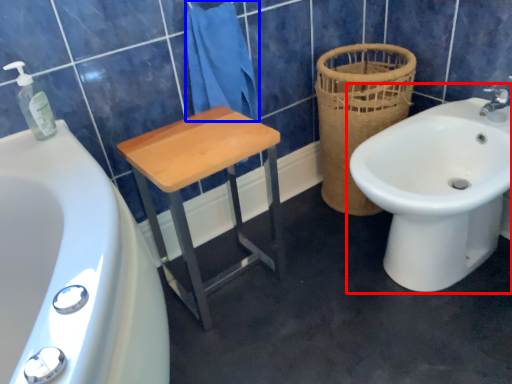
Question: Which object is closer to the camera taking this photo, sink (highlighted by a red box) or bath towel (highlighted by a blue box)?

Choices:
 (A) sink
 (B) bath towel

Answer: (A)